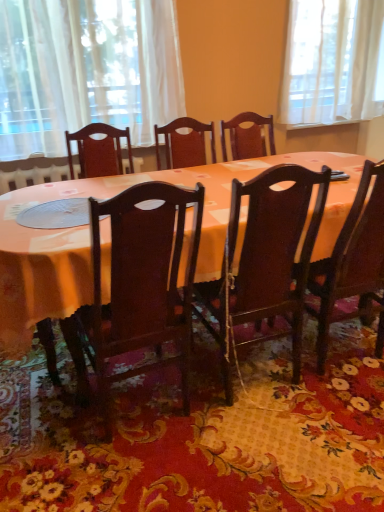
Where is `free point to the left of dark wood chair at center, the 3th chair when ordered from right to left`? free point to the left of dark wood chair at center, the 3th chair when ordered from right to left is located at coordinates (48, 436).